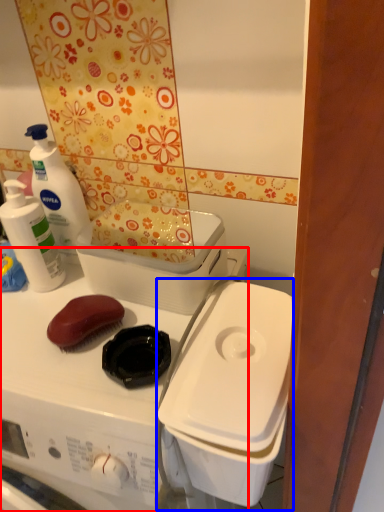
Question: Which object is further to the camera taking this photo, washing machine (highlighted by a red box) or appliance (highlighted by a blue box)?

Choices:
 (A) washing machine
 (B) appliance

Answer: (B)